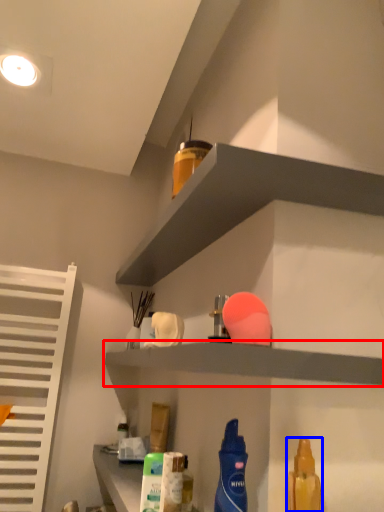
Question: Which object appears farthest to the camera in this image, shelf (highlighted by a red box) or cleaning product (highlighted by a blue box)?

Choices:
 (A) shelf
 (B) cleaning product

Answer: (A)